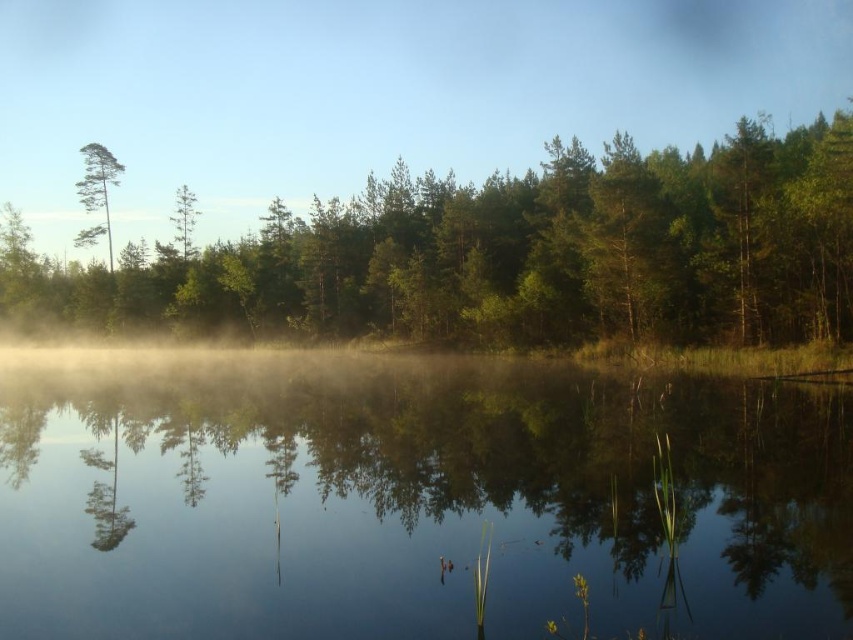
You are standing at the edge of the forest and want to cross to the other side. You see the transparent water at center and the green matte tree at left. Which path would allow you to walk without getting your shoes wet?

The green matte tree at left is wider than the transparent water at center, so walking along the green matte tree at left would keep you on dry land and avoid the water.

You are standing at the edge of the forest lake and notice a point in the water. What is located at point (410, 499)?

At point (410, 499) lies transparent water at center.

You are standing at the edge of the forest lake and see two points in the water. The first point is at coordinates point (809, 326) and the second is at point (117, 172). Which point is closer to your viewpoint?

Point (809, 326) is closer to the camera than point (117, 172), so the first point is closer to your viewpoint.